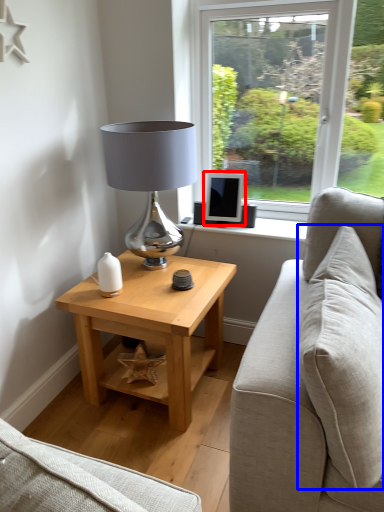
Question: Which of the following is the farthest to the observer, computer monitor (highlighted by a red box) or pillow (highlighted by a blue box)?

Choices:
 (A) computer monitor
 (B) pillow

Answer: (A)